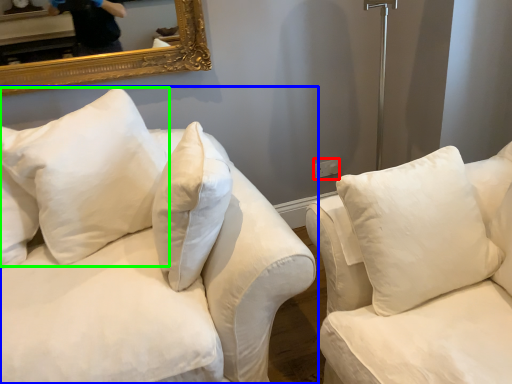
Question: Considering the real-world distances, which object is closest to electric outlet (highlighted by a red box)? studio couch (highlighted by a blue box) or pillow (highlighted by a green box).

Choices:
 (A) studio couch
 (B) pillow

Answer: (B)